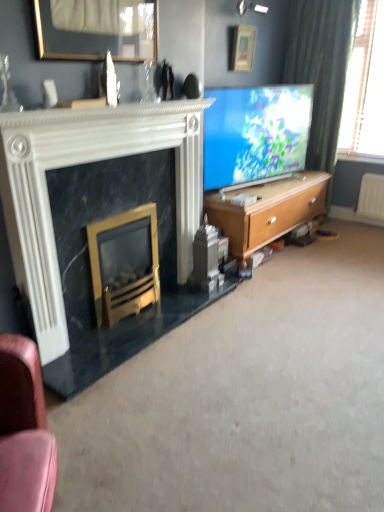
Question: Does wooden picture frame at upper center, placed as the first picture frame when sorted from front to back, have a smaller size compared to white marble fireplace at left, acting as the 1th fireplace starting from the top?

Choices:
 (A) no
 (B) yes

Answer: (B)

Question: Does wooden picture frame at upper center, placed as the second picture frame when sorted from right to left, appear on the right side of white marble fireplace at left, which is the 2th fireplace in bottom-to-top order?

Choices:
 (A) no
 (B) yes

Answer: (A)

Question: Is wooden picture frame at upper center, placed as the first picture frame when sorted from front to back, oriented away from white marble fireplace at left, acting as the 1th fireplace starting from the top?

Choices:
 (A) no
 (B) yes

Answer: (A)

Question: From the image's perspective, is wooden picture frame at upper center, placed as the first picture frame when sorted from front to back, under white marble fireplace at left, which is the 2th fireplace in bottom-to-top order?

Choices:
 (A) yes
 (B) no

Answer: (B)

Question: Is wooden picture frame at upper center, arranged as the 1th picture frame when viewed from the left, shorter than white marble fireplace at left, acting as the 1th fireplace starting from the top?

Choices:
 (A) yes
 (B) no

Answer: (A)

Question: Does wooden picture frame at upper center, the second picture frame when ordered from top to bottom, have a greater width compared to white marble fireplace at left, which is the 2th fireplace in bottom-to-top order?

Choices:
 (A) yes
 (B) no

Answer: (B)

Question: Is matte blue screen at center facing towards wooden cabinet at right?

Choices:
 (A) yes
 (B) no

Answer: (B)

Question: Is matte blue screen at center turned away from wooden cabinet at right?

Choices:
 (A) yes
 (B) no

Answer: (B)

Question: Can you confirm if matte blue screen at center is smaller than wooden cabinet at right?

Choices:
 (A) no
 (B) yes

Answer: (B)

Question: Does matte blue screen at center have a greater height compared to wooden cabinet at right?

Choices:
 (A) yes
 (B) no

Answer: (A)

Question: Is matte blue screen at center placed right next to wooden cabinet at right?

Choices:
 (A) yes
 (B) no

Answer: (B)

Question: From the image's perspective, is matte blue screen at center over wooden cabinet at right?

Choices:
 (A) yes
 (B) no

Answer: (A)

Question: Is gold metallic fireplace at lower left, which is the second fireplace from top to bottom, outside of white marble fireplace at left, acting as the 1th fireplace starting from the top?

Choices:
 (A) yes
 (B) no

Answer: (B)